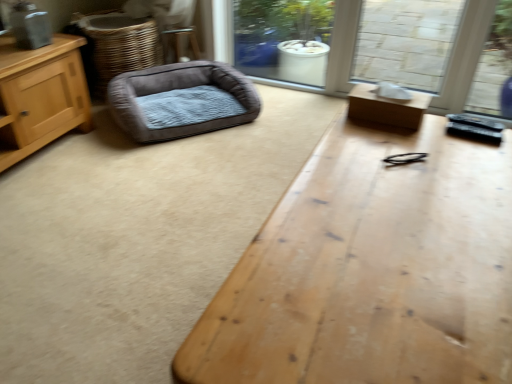
Question: Looking at their shapes, would you say brown cardboard box at right, positioned as the second table in bottom-to-top order, is wider or thinner than brown woven basket at left?

Choices:
 (A) wide
 (B) thin

Answer: (B)

Question: From the image's perspective, is brown cardboard box at right, marked as the 1th table in a top-to-bottom arrangement, above or below brown woven basket at left?

Choices:
 (A) below
 (B) above

Answer: (A)

Question: Which of these objects is positioned farthest from the brown woven basket at left?

Choices:
 (A) wooden table at center, which is the 2th table in top-to-bottom order
 (B) brown cardboard box at right, positioned as the second table in bottom-to-top order
 (C) velvet-like brown dog bed at left

Answer: (A)

Question: Based on their relative distances, which object is nearer to the wooden table at center, the 1th table when ordered from bottom to top?

Choices:
 (A) brown cardboard box at right, marked as the 1th table in a top-to-bottom arrangement
 (B) velvet-like brown dog bed at left
 (C) brown woven basket at left

Answer: (A)